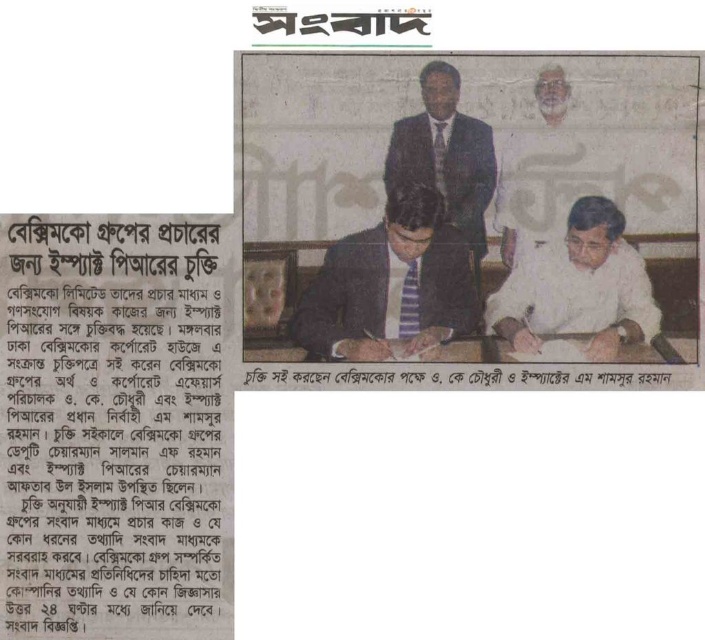
You are standing 1 meter away from the newspaper clipping. The point at coordinates (639, 301) is part of the image. Can you reach this point without moving closer to the clipping?

The point at coordinates (639, 301) is 1.06 meters away from you, so you cannot reach it without moving closer since you are currently 1 meter away.

What is located at the point with coordinates (114, 428) in the image?

The point at coordinates (114, 428) indicates the white paper text at upper left.

In the newspaper clipping, there are two men seated at a table in formal attire. The men are wearing a white matte shirt at center and a dark blue suit at center. Which of these two items of clothing is visually larger in the image?

The white matte shirt at center is visually larger compared to the dark blue suit at center in the image.